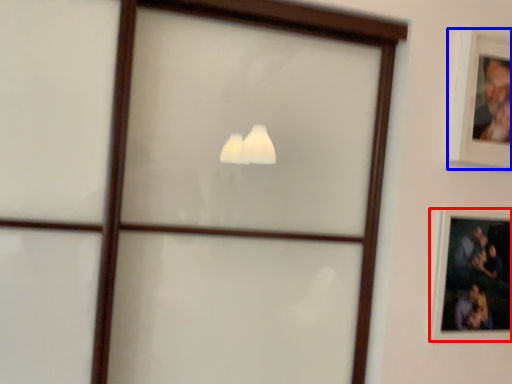
Question: Which point is further to the camera, picture frame (highlighted by a red box) or picture frame (highlighted by a blue box)?

Choices:
 (A) picture frame
 (B) picture frame

Answer: (A)